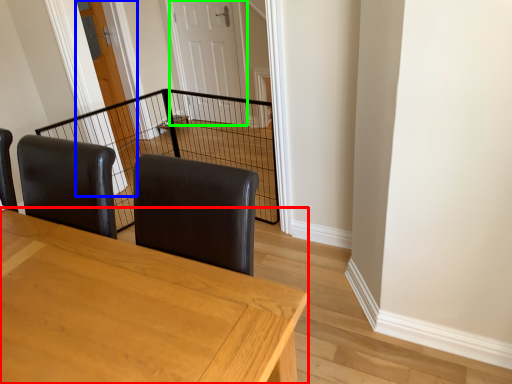
Question: Estimate the real-world distances between objects in this image. Which object is farther from table (highlighted by a red box), door (highlighted by a blue box) or door (highlighted by a green box)?

Choices:
 (A) door
 (B) door

Answer: (B)